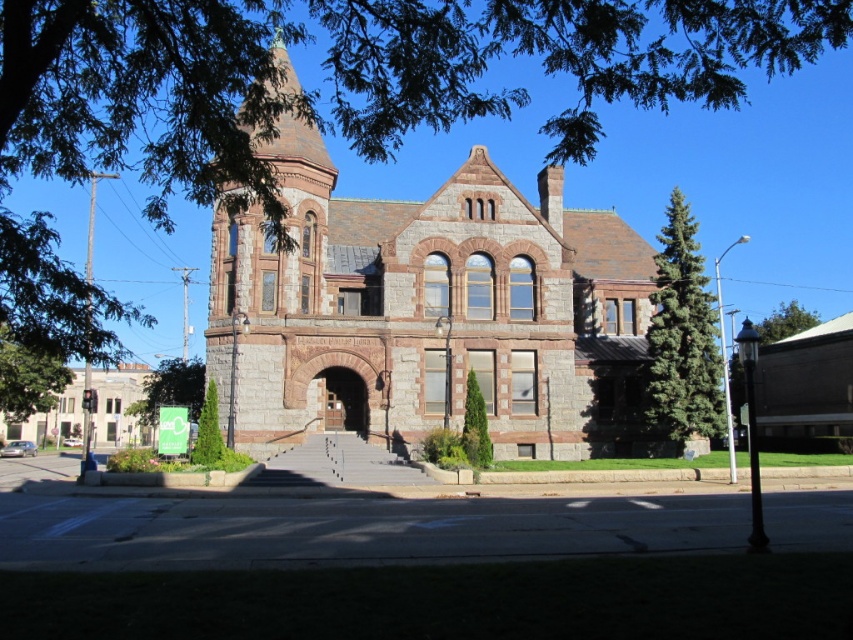
Question: Is gray stone church at center bigger than green leafy tree at lower left?

Choices:
 (A) no
 (B) yes

Answer: (B)

Question: Where is green leafy tree at left located in relation to green leafy tree at lower left in the image?

Choices:
 (A) above
 (B) below

Answer: (A)

Question: Which is nearer to the green textured tree at center?

Choices:
 (A) green leafy tree at upper right
 (B) green fir tree at right
 (C) green leafy tree at left
 (D) gray stone church at center

Answer: (D)

Question: Which object is positioned farthest from the green textured hedge at lower left?

Choices:
 (A) green leafy tree at lower left
 (B) green textured tree at center
 (C) green leafy tree at left
 (D) gray stone church at center

Answer: (C)

Question: Is gray stone church at center wider than green leafy tree at upper right?

Choices:
 (A) yes
 (B) no

Answer: (A)

Question: Which of these objects is positioned closest to the green leafy tree at left?

Choices:
 (A) green fir tree at right
 (B) green textured tree at center
 (C) green leafy tree at lower left
 (D) gray stone church at center

Answer: (C)